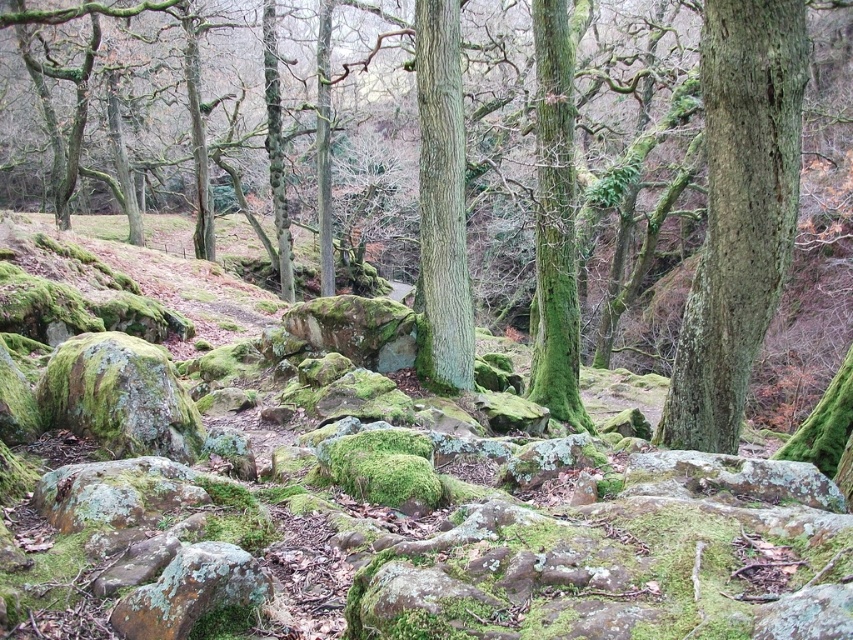
You are standing at the origin point of the image coordinate system, where the bottom left corner is the origin. You want to locate the green rough bark tree at right. What are its coordinates?

The green rough bark tree at right is located at coordinates [738,212] in the image coordinate system.

Based on the photo, you are standing at the point labeled as point (782, 93) in the woodland scene. If you want to take a photo of this point using a camera that has a maximum focus range of 5 meters, will the camera be able to focus on the point?

The distance between point (782, 93) and the camera is 5.56 meters, which exceeds the camera maximum focus range of 5 meters. Therefore, the camera will not be able to focus on the point.